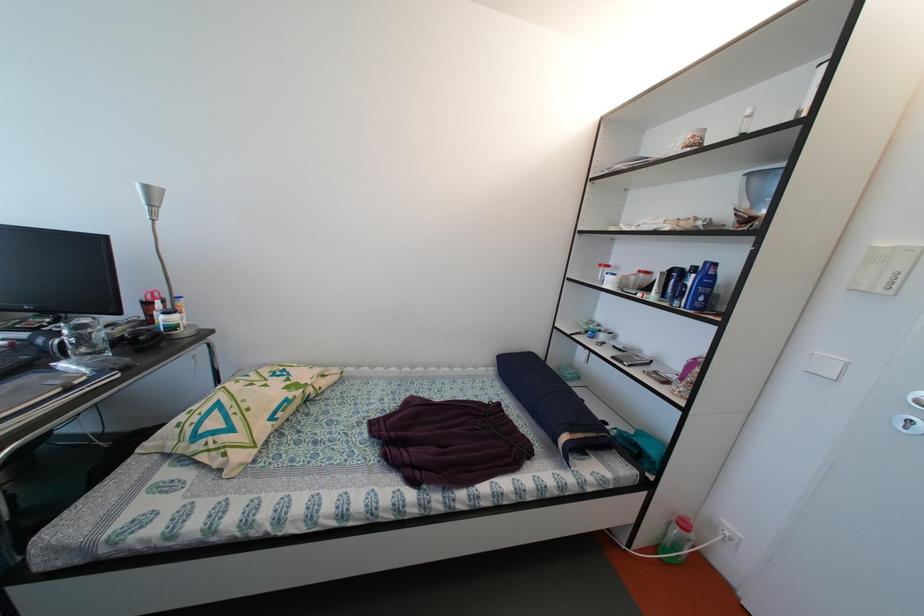
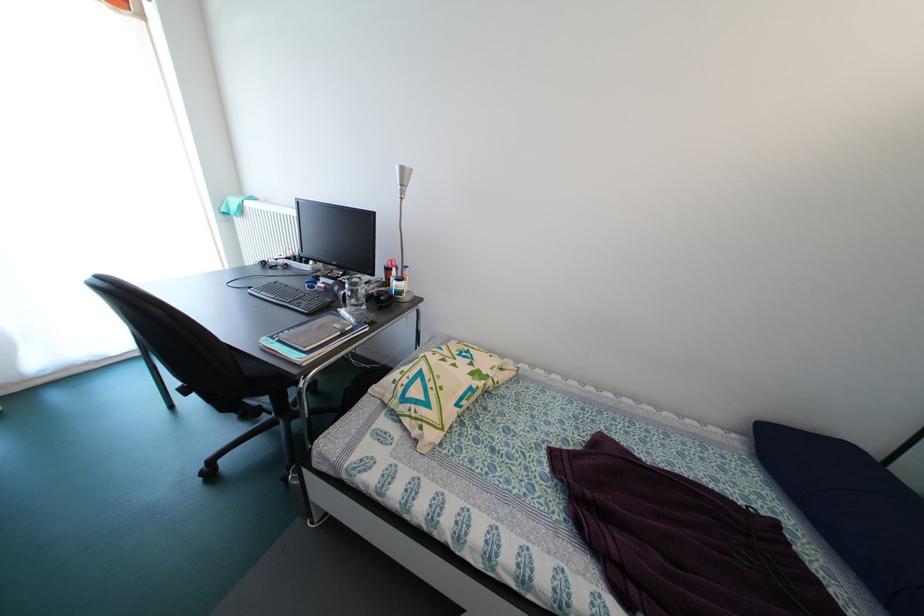
In the second image, find the point that corresponds to (x=47, y=346) in the first image.

(344, 294)